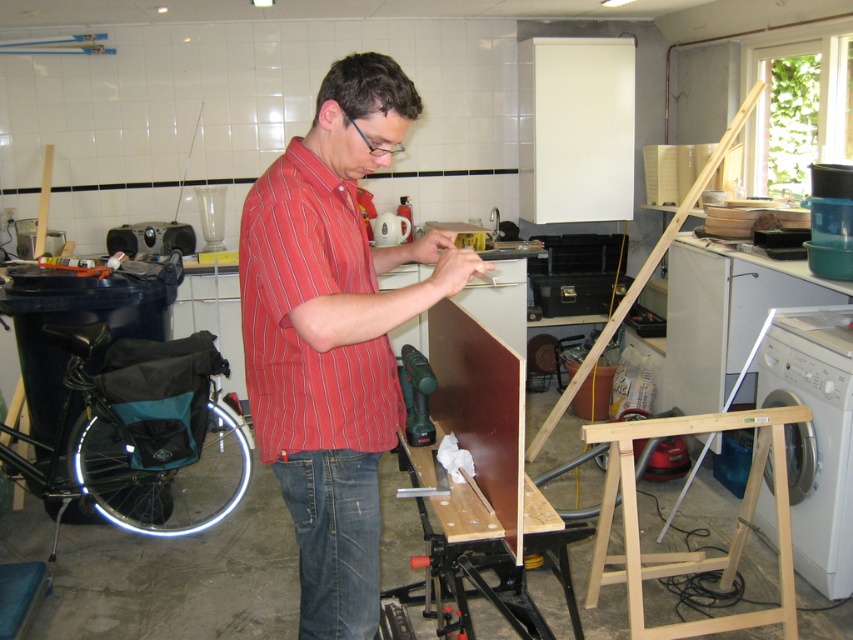
Which is in front, point (337, 477) or point (421, 412)?

Point (337, 477) is more forward.

Is denim jeans at lower center below green plastic drill at center?

Yes, denim jeans at lower center is below green plastic drill at center.

Is point (373, 502) positioned in front of point (408, 349)?

Yes, point (373, 502) is in front of point (408, 349).

Locate an element on the screen. denim jeans at lower center is located at coordinates (334, 540).

Does red striped shirt at center appear over green plastic drill at center?

Indeed, red striped shirt at center is positioned over green plastic drill at center.

This screenshot has height=640, width=853. What do you see at coordinates (334, 333) in the screenshot? I see `red striped shirt at center` at bounding box center [334, 333].

You are a GUI agent. You are given a task and a screenshot of the screen. Output one action in this format:
    pyautogui.click(x=<x>, y=<y>)
    Task: Click on the red striped shirt at center
    Image resolution: width=853 pixels, height=640 pixels.
    Given the screenshot: What is the action you would take?
    pyautogui.click(x=334, y=333)

Which is above, teal fabric bicycle wheel at lower left or green plastic drill at center?

green plastic drill at center is higher up.

This screenshot has height=640, width=853. I want to click on teal fabric bicycle wheel at lower left, so click(161, 476).

Locate an element on the screen. This screenshot has width=853, height=640. teal fabric bicycle wheel at lower left is located at coordinates (161, 476).